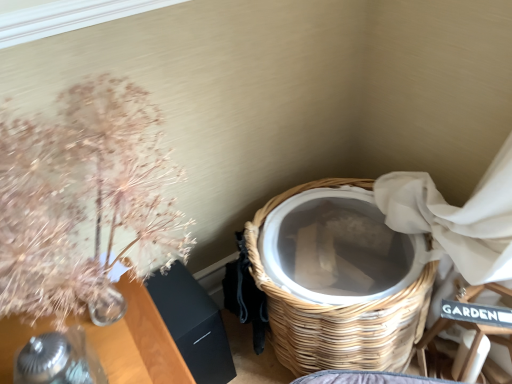
Question: Is point (433, 337) closer or farther from the camera than point (364, 322)?

Choices:
 (A) closer
 (B) farther

Answer: (B)

Question: Based on their positions, is wooden armchair at lower right located to the left or right of woven wood basket at lower right?

Choices:
 (A) left
 (B) right

Answer: (B)

Question: Based on their relative distances, which object is farther from the wooden armchair at lower right?

Choices:
 (A) translucent glass vase with dried flowers at upper left
 (B) woven wood basket at lower right

Answer: (A)

Question: Estimate the real-world distances between objects in this image. Which object is closer to the woven wood basket at lower right?

Choices:
 (A) wooden armchair at lower right
 (B) translucent glass vase with dried flowers at upper left

Answer: (A)